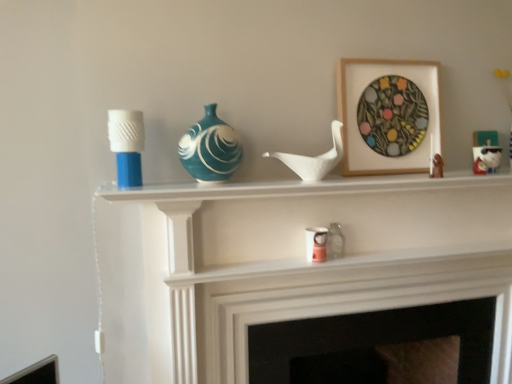
Question: Considering their positions, is teal glossy vase at center located in front of or behind matte brown figurine at upper right, which is the 2th toy in left-to-right order?

Choices:
 (A) front
 (B) behind

Answer: (A)

Question: From the image's perspective, is teal glossy vase at center located above or below matte brown figurine at upper right, placed as the second toy when sorted from right to left?

Choices:
 (A) below
 (B) above

Answer: (B)

Question: Which object is the closest to the pink paper cup at center, which is counted as the second candle holder, starting from the left?

Choices:
 (A) white glossy shelf at upper center
 (B) teal glossy vase at center
 (C) white glossy figurine at upper right, which ranks as the first toy in right-to-left order
 (D) white matte candle holder at left, arranged as the first candle holder when viewed from the left
 (E) wooden picture frame at upper center

Answer: (A)

Question: Considering the real-world distances, which object is closest to the pink paper cup at center, the 1th candle holder in the right-to-left sequence?

Choices:
 (A) matte white fireplace at center
 (B) white matte bird at center, the first toy from the front
 (C) white matte candle holder at left, arranged as the 1th candle holder when viewed from the front
 (D) white glossy shelf at upper center
 (E) teal glossy vase at center

Answer: (B)